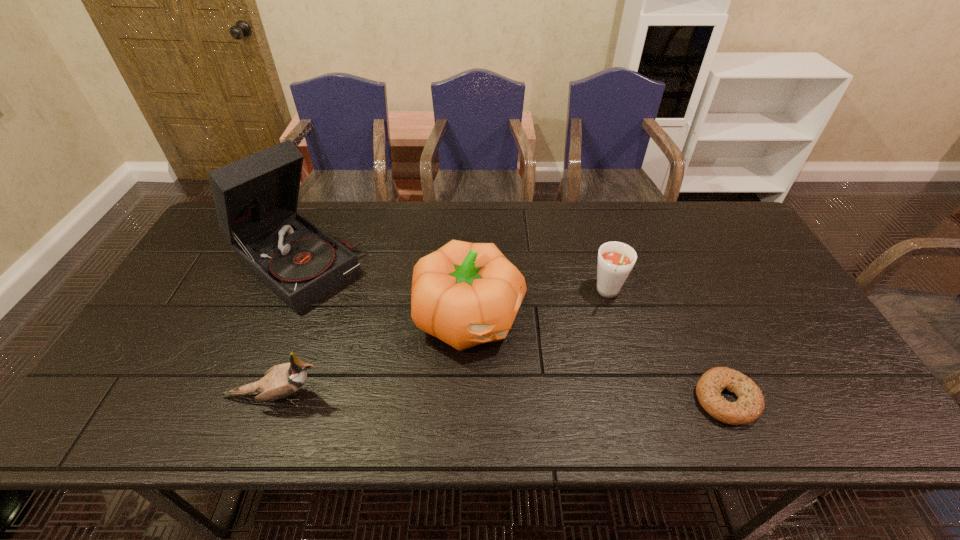
This screenshot has height=540, width=960. Find the location of `free spot located 0.290m on the front-facing side of the tallest object`. free spot located 0.290m on the front-facing side of the tallest object is located at coordinates 406,353.

Locate an element on the screen. The width and height of the screenshot is (960, 540). vacant point located on the front-facing side of the tallest object is located at coordinates (371, 324).

This screenshot has height=540, width=960. Find the location of `free space located 0.270m on the front-facing side of the tallest object`. free space located 0.270m on the front-facing side of the tallest object is located at coordinates (401, 348).

What are the coordinates of `vacant space situated on the drink side of the fourth object from left to right` in the screenshot? It's located at (586, 360).

Locate an element on the screen. vacant space located on the drink side of the fourth object from left to right is located at coordinates (588, 354).

Where is `free space located on the drink side of the fourth object from left to right`? free space located on the drink side of the fourth object from left to right is located at coordinates (593, 339).

You are a GUI agent. You are given a task and a screenshot of the screen. Output one action in this format:
    pyautogui.click(x=<x>, y=<y>)
    Task: Click on the object positioned at the far edge
    Image resolution: width=960 pixels, height=540 pixels.
    Given the screenshot: What is the action you would take?
    pyautogui.click(x=255, y=198)

The height and width of the screenshot is (540, 960). Find the location of `bird located at the near edge`. bird located at the near edge is located at coordinates (280, 381).

Identify the location of bagel situated at the near edge. This screenshot has height=540, width=960. (750, 404).

Locate an element on the screen. The image size is (960, 540). pumpkin that is positioned at the near edge is located at coordinates (465, 294).